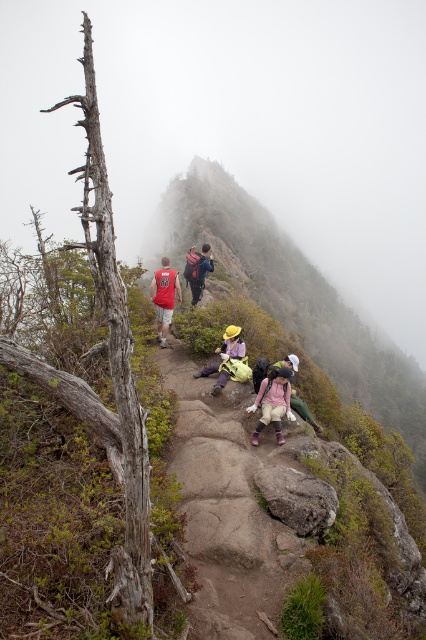
You are a photographer trying to capture the hikers on the trail. You notice the khaki pants at center and the matte red backpack at center. Which object should you focus on first if you want to photograph the one that is more to the right?

The khaki pants at center is positioned on the right side of matte red backpack at center, so you should focus on the khaki pants at center first as it is more to the right.